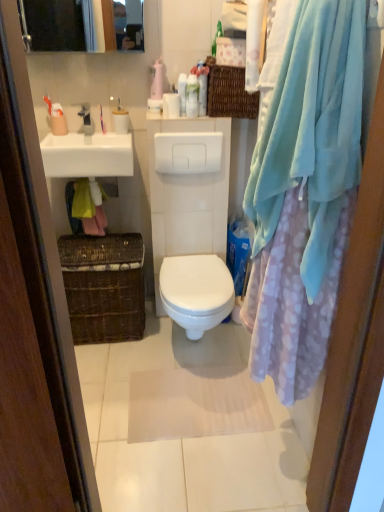
Question: Does white glossy sink at upper left come in front of matte plastic toothbrush at upper left, which is counted as the first toiletry, starting from the left?

Choices:
 (A) yes
 (B) no

Answer: (A)

Question: Can you confirm if white glossy sink at upper left is wider than matte plastic toothbrush at upper left, which is counted as the first toiletry, starting from the left?

Choices:
 (A) yes
 (B) no

Answer: (A)

Question: Does white glossy sink at upper left have a lesser height compared to matte plastic toothbrush at upper left, which is counted as the first toiletry, starting from the left?

Choices:
 (A) yes
 (B) no

Answer: (B)

Question: From a real-world perspective, is white glossy sink at upper left under matte plastic toothbrush at upper left, which is counted as the first toiletry, starting from the left?

Choices:
 (A) yes
 (B) no

Answer: (A)

Question: Is white glossy sink at upper left far away from matte plastic toothbrush at upper left, which is counted as the first toiletry, starting from the left?

Choices:
 (A) no
 (B) yes

Answer: (A)

Question: Is white glossy sink at upper left oriented towards matte plastic toothbrush at upper left, which appears as the sixth toiletry when viewed from the right?

Choices:
 (A) no
 (B) yes

Answer: (A)

Question: Could you tell me if white glossy lotion at upper center, which appears as the sixth toiletry when viewed from the left, is facing yellow fabric at lower left?

Choices:
 (A) yes
 (B) no

Answer: (B)

Question: Is white glossy lotion at upper center, which appears as the sixth toiletry when viewed from the left, far from yellow fabric at lower left?

Choices:
 (A) yes
 (B) no

Answer: (B)

Question: From the image's perspective, is white glossy lotion at upper center, the 1th toiletry positioned from the right, on yellow fabric at lower left?

Choices:
 (A) no
 (B) yes

Answer: (B)

Question: Considering the relative positions of white glossy lotion at upper center, which appears as the sixth toiletry when viewed from the left, and yellow fabric at lower left in the image provided, is white glossy lotion at upper center, which appears as the sixth toiletry when viewed from the left, to the left of yellow fabric at lower left from the viewer's perspective?

Choices:
 (A) yes
 (B) no

Answer: (B)

Question: Considering the relative positions of white glossy lotion at upper center, which appears as the sixth toiletry when viewed from the left, and yellow fabric at lower left in the image provided, is white glossy lotion at upper center, which appears as the sixth toiletry when viewed from the left, to the right of yellow fabric at lower left from the viewer's perspective?

Choices:
 (A) no
 (B) yes

Answer: (B)

Question: Is white glossy lotion at upper center, the 1th toiletry positioned from the right, not within yellow fabric at lower left?

Choices:
 (A) yes
 (B) no

Answer: (A)

Question: Does white glossy bottle at upper center, which is the second toiletry in right-to-left order, touch white glossy toilet paper at upper center, the 3th toiletry viewed from the left?

Choices:
 (A) no
 (B) yes

Answer: (B)